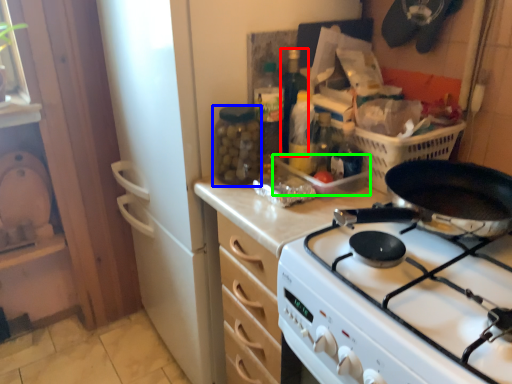
Question: Based on their relative distances, which object is nearer to bottle (highlighted by a red box)? Choose from bottle (highlighted by a blue box) and appliance (highlighted by a green box).

Choices:
 (A) bottle
 (B) appliance

Answer: (A)